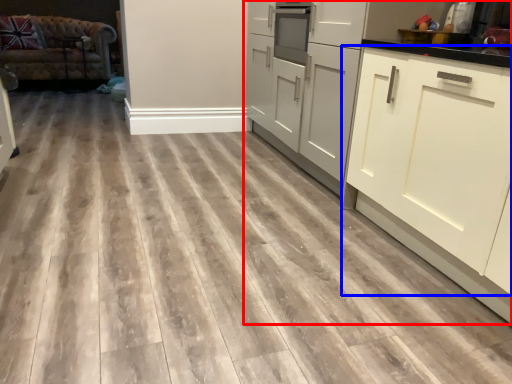
Question: Which point is closer to the camera, cabinetry (highlighted by a red box) or cabinetry (highlighted by a blue box)?

Choices:
 (A) cabinetry
 (B) cabinetry

Answer: (A)